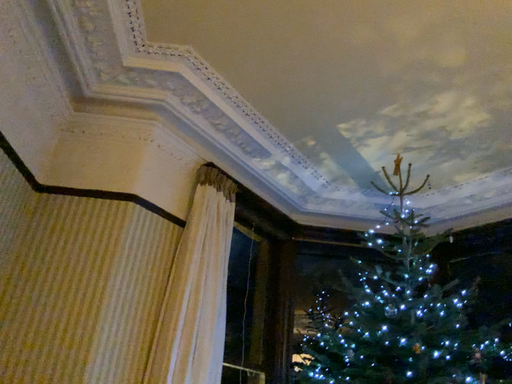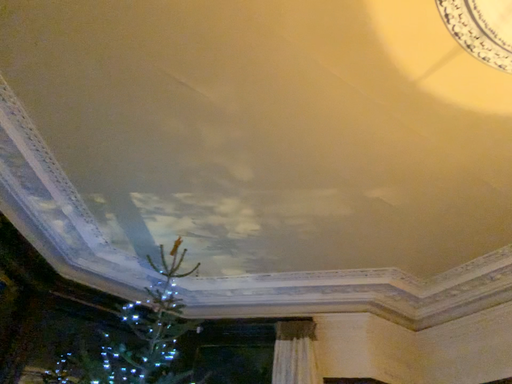
Question: How did the camera likely rotate when shooting the video?

Choices:
 (A) rotated left
 (B) rotated right

Answer: (B)